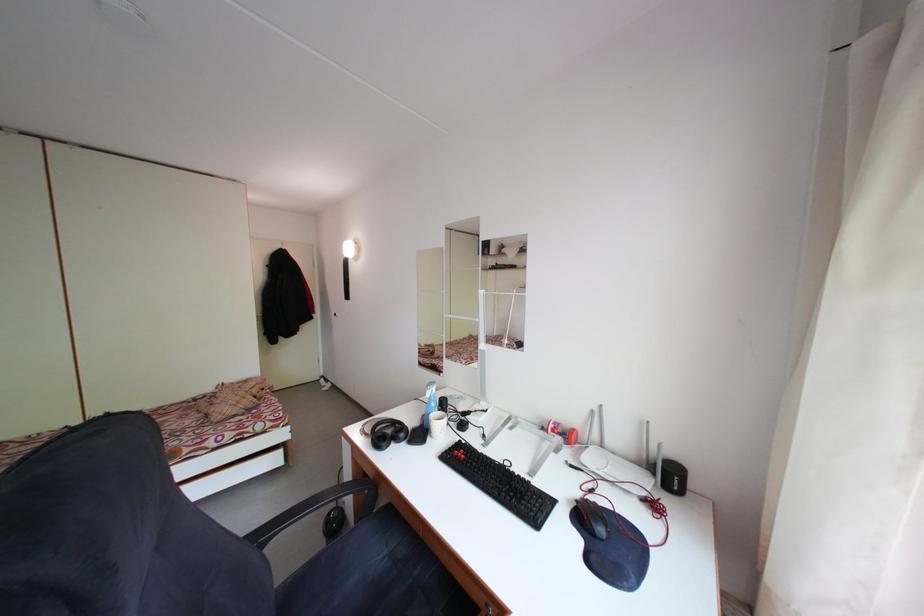
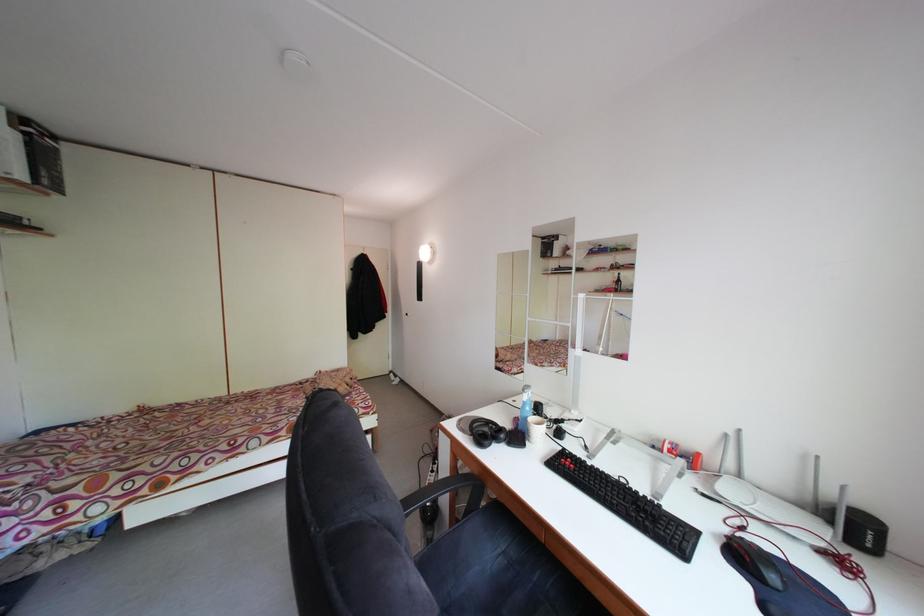
The point at (433, 431) is marked in the first image. Where is the corresponding point in the second image?

(528, 434)